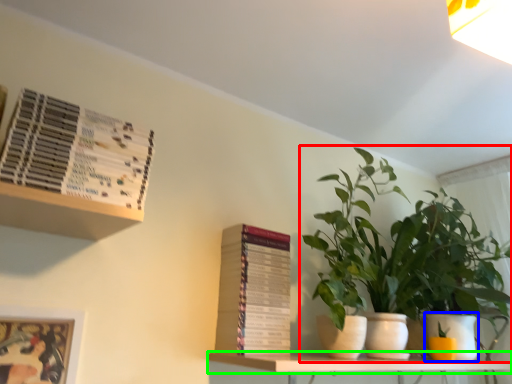
Question: Which object is the farthest from houseplant (highlighted by a red box)? Choose among these: flowerpot (highlighted by a blue box) or shelf (highlighted by a green box).

Choices:
 (A) flowerpot
 (B) shelf

Answer: (B)